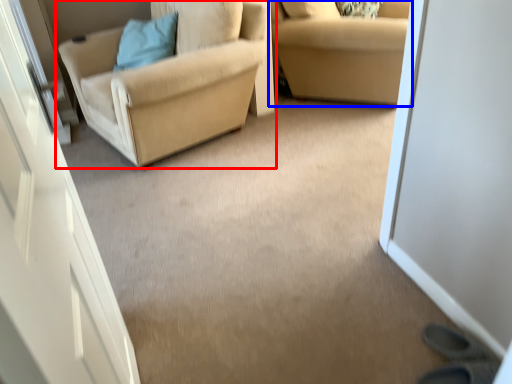
Question: Which object appears closest to the camera in this image, chair (highlighted by a red box) or studio couch (highlighted by a blue box)?

Choices:
 (A) chair
 (B) studio couch

Answer: (A)